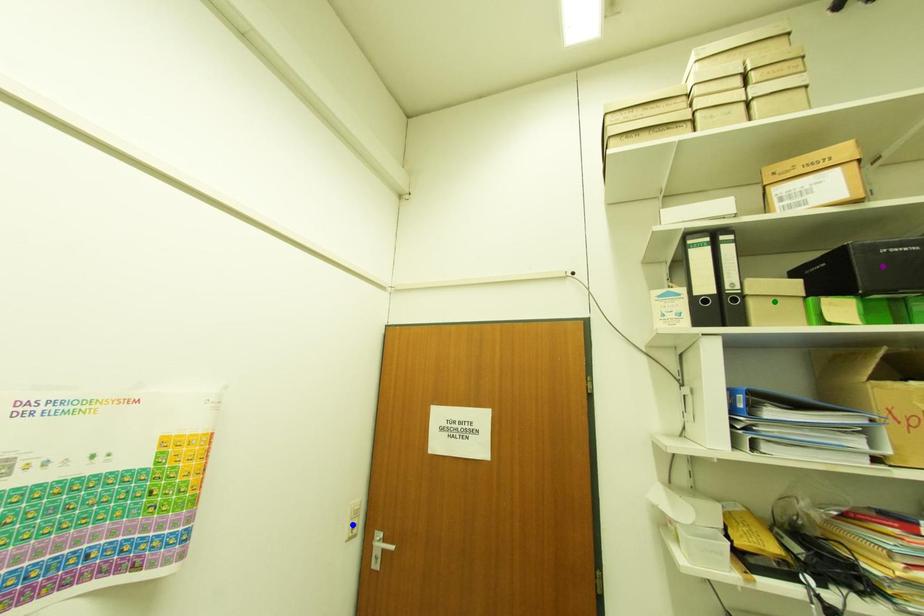
Order these from nearest to farthest:
purple point, blue point, green point

purple point < green point < blue point